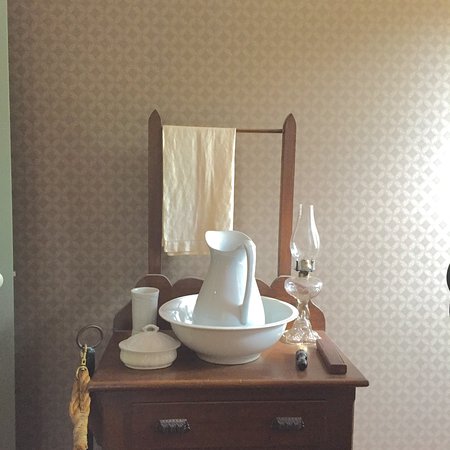
Where is `victorian style wash stand`? victorian style wash stand is located at coordinates [x=336, y=399].